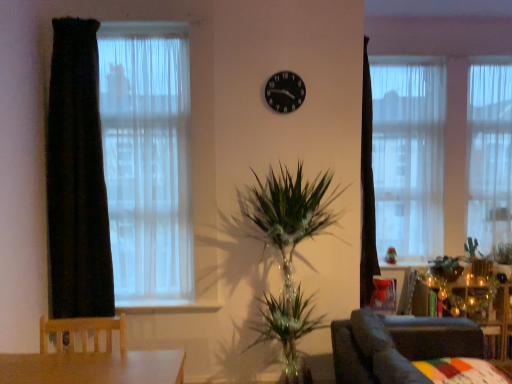
You are a GUI agent. You are given a task and a screenshot of the screen. Output one action in this format:
    pyautogui.click(x=<x>, y=<y>)
    Task: Click on the vacant space situated above white sheer curtain at left (from a real-world perspective)
    Image resolution: width=512 pixels, height=384 pixels.
    Given the screenshot: What is the action you would take?
    pyautogui.click(x=116, y=22)